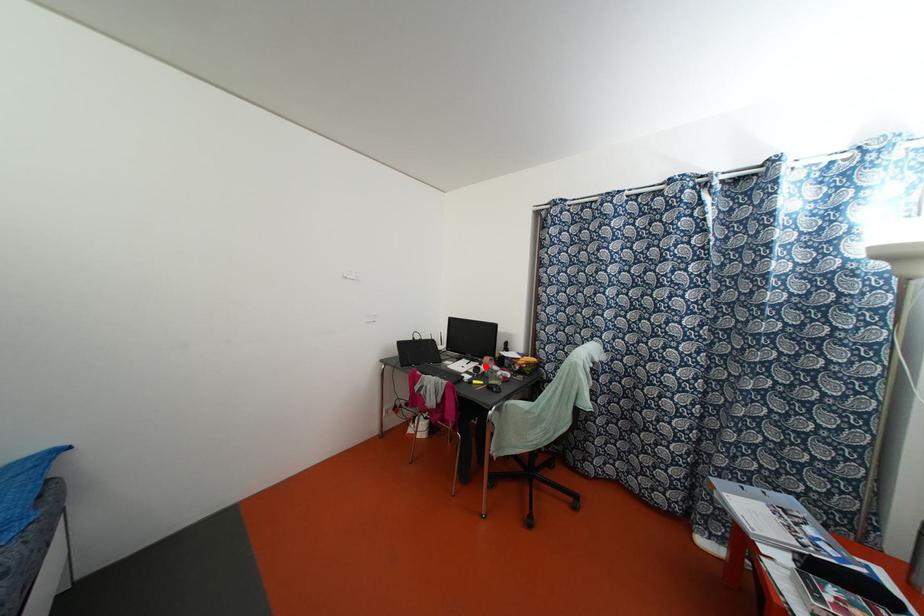
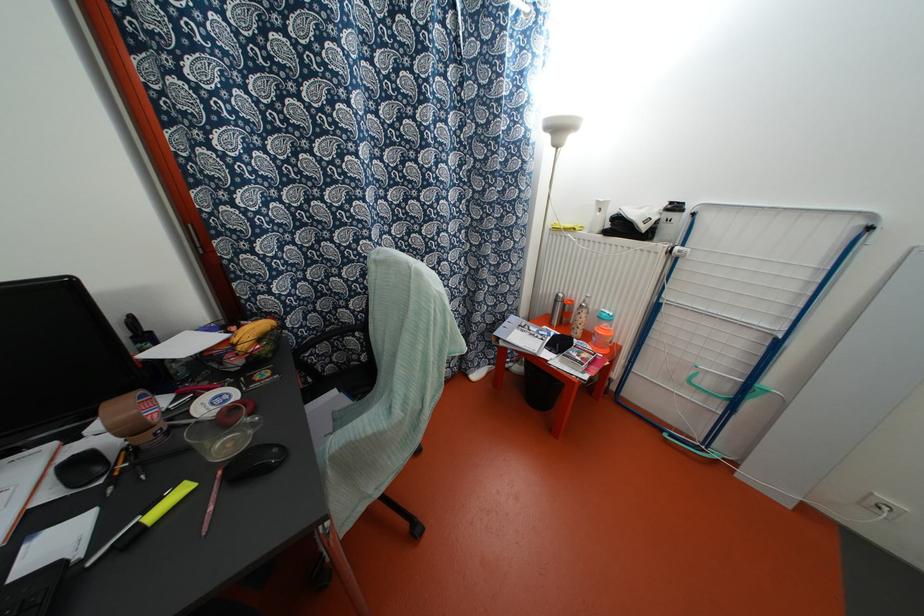
Where in the second image is the point corresponding to the highlighted location from the first image?

(131, 429)